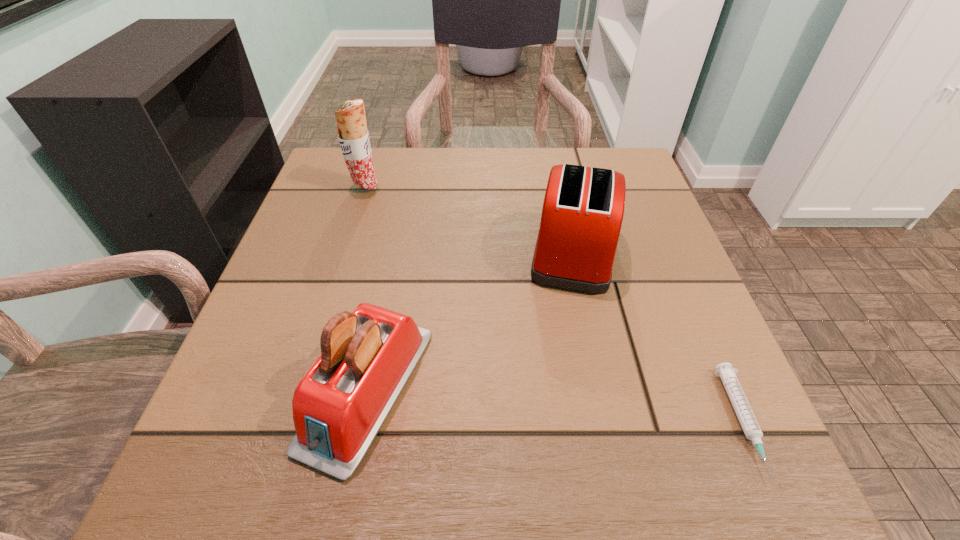
I want to click on vacant space at the far edge of the desktop, so click(x=557, y=154).

In the image, there is a desktop. Identify the location of vacant area at the left edge. (258, 378).

Identify the location of free space at the right edge of the desktop. [685, 346].

Locate an element on the screen. The height and width of the screenshot is (540, 960). free point at the far left corner is located at coordinates (374, 155).

In order to click on vacant space at the far right corner in this screenshot , I will do `click(642, 195)`.

Locate an element on the screen. The image size is (960, 540). free space between the nearer toaster and the farthest object is located at coordinates (367, 288).

What are the coordinates of `free space between the rightmost object and the second farthest object` in the screenshot? It's located at 658,336.

Identify the location of free point between the shortest object and the left toaster. pos(555,406).

The width and height of the screenshot is (960, 540). I want to click on free spot between the second object from right to left and the farthest object, so click(469, 219).

In order to click on free space between the nearer toaster and the shortest object in this screenshot , I will do `click(555, 406)`.